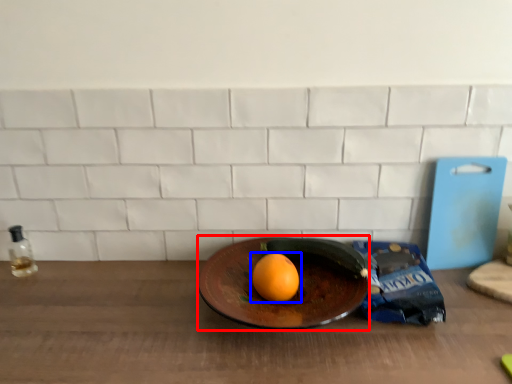
Question: Which of the following is the closest to the observer, plate (highlighted by a red box) or grapefruit (highlighted by a blue box)?

Choices:
 (A) plate
 (B) grapefruit

Answer: (A)